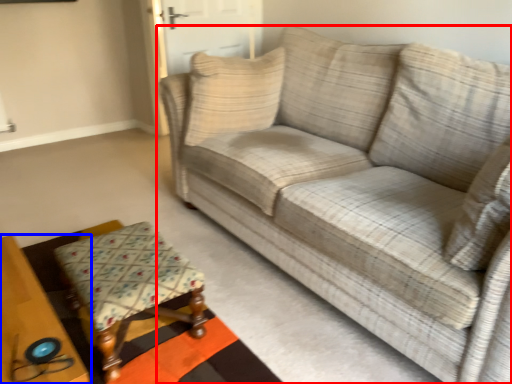
Question: Which of the following is the farthest to the observer, studio couch (highlighted by a red box) or table (highlighted by a blue box)?

Choices:
 (A) studio couch
 (B) table

Answer: (B)